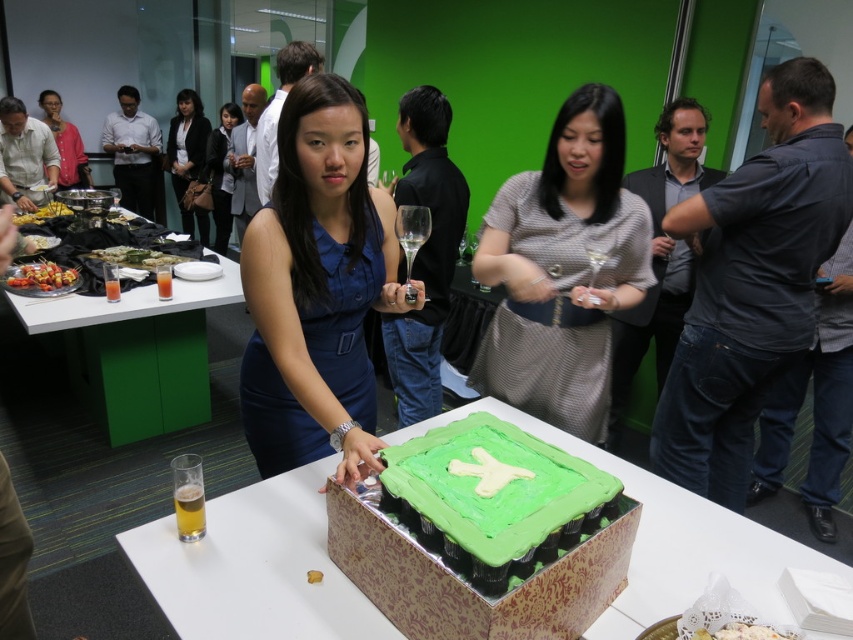
Based on the photo, can you confirm if blue satin dress at center is bigger than translucent glass at lower left?

Yes, blue satin dress at center is bigger than translucent glass at lower left.

Can you confirm if blue satin dress at center is taller than translucent glass at lower left?

Yes, blue satin dress at center is taller than translucent glass at lower left.

The height and width of the screenshot is (640, 853). What do you see at coordinates (317, 289) in the screenshot?
I see `blue satin dress at center` at bounding box center [317, 289].

The image size is (853, 640). What are the coordinates of `blue satin dress at center` in the screenshot? It's located at (317, 289).

Can you confirm if shiny metallic skewers at left is wider than white creamy mashed potatoes at center?

Yes, shiny metallic skewers at left is wider than white creamy mashed potatoes at center.

Does shiny metallic skewers at left appear over white creamy mashed potatoes at center?

Yes, shiny metallic skewers at left is above white creamy mashed potatoes at center.

The height and width of the screenshot is (640, 853). I want to click on shiny metallic skewers at left, so click(x=41, y=276).

How distant is dark blue dress at center from green matte sushi at center?

The distance of dark blue dress at center from green matte sushi at center is 2.86 meters.

Which is more to the right, dark blue dress at center or green matte sushi at center?

green matte sushi at center

In order to click on dark blue dress at center in this screenshot , I will do `click(189, 157)`.